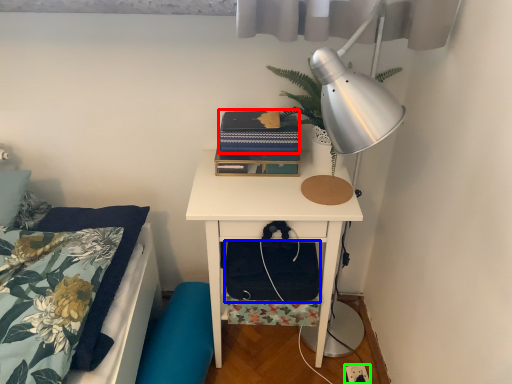
Question: Estimate the real-world distances between objects in this image. Which object is farther from paperback book (highlighted by a red box), footrest (highlighted by a blue box) or electric outlet (highlighted by a green box)?

Choices:
 (A) footrest
 (B) electric outlet

Answer: (B)